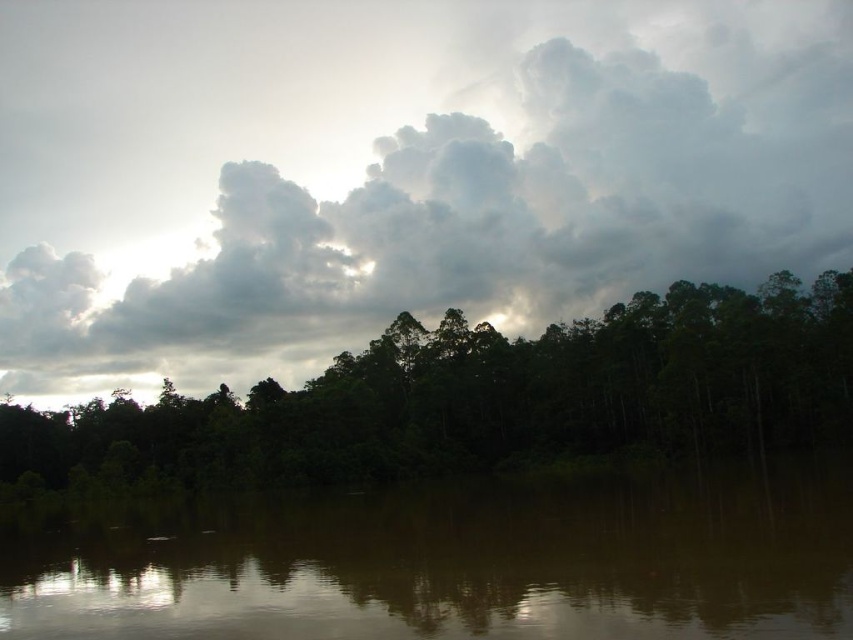
Question: Observing the image, what is the correct spatial positioning of cloudy sky at upper center in reference to dark green trees at center?

Choices:
 (A) right
 (B) left

Answer: (A)

Question: Can you confirm if cloudy sky at upper center is wider than brown reflective water at center?

Choices:
 (A) no
 (B) yes

Answer: (B)

Question: Which of the following is the closest to the observer?

Choices:
 (A) (444, 440)
 (B) (247, 348)
 (C) (396, 522)

Answer: (C)

Question: Considering the relative positions of cloudy sky at upper center and brown reflective water at center in the image provided, where is cloudy sky at upper center located with respect to brown reflective water at center?

Choices:
 (A) right
 (B) left

Answer: (B)

Question: Among these points, which one is nearest to the camera?

Choices:
 (A) (165, 627)
 (B) (341, 476)

Answer: (A)

Question: Which point is farther to the camera?

Choices:
 (A) cloudy sky at upper center
 (B) dark green trees at center

Answer: (A)